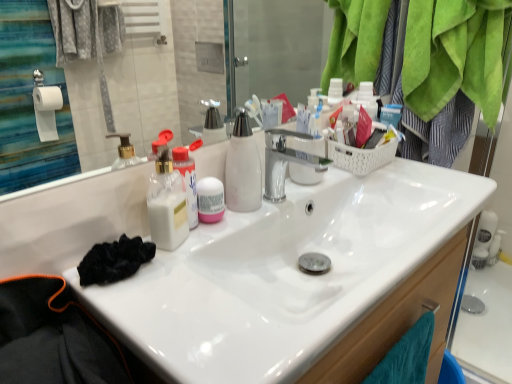
Measure the distance between point (386, 200) and camera.

They are 38.78 inches apart.

This screenshot has height=384, width=512. Describe the element at coordinates (334, 241) in the screenshot. I see `white glossy sink at center` at that location.

Locate an element on the screen. white glossy sink at center is located at coordinates (334, 241).

You are a GUI agent. You are given a task and a screenshot of the screen. Output one action in this format:
    pyautogui.click(x=<x>, y=<y>)
    Task: Click on the pink matte deodorant at center
    
    Given the screenshot: What is the action you would take?
    pyautogui.click(x=210, y=200)

This screenshot has height=384, width=512. Describe the element at coordinates (210, 200) in the screenshot. I see `pink matte deodorant at center` at that location.

You are a GUI agent. You are given a task and a screenshot of the screen. Output one action in this format:
    pyautogui.click(x=<x>, y=<y>)
    Task: Click on the white glossy sink at center
    This screenshot has height=384, width=512.
    Given the screenshot: What is the action you would take?
    pyautogui.click(x=334, y=241)

Which object is positioned more to the left, pink matte deodorant at center or white glossy sink at center?

From the viewer's perspective, pink matte deodorant at center appears more on the left side.

Which is behind, pink matte deodorant at center or white glossy sink at center?

pink matte deodorant at center is further from the camera.

Between point (209, 199) and point (354, 311), which one is positioned in front?

Positioned in front is point (354, 311).

From the image's perspective, is pink matte deodorant at center on top of white glossy sink at center?

Yes, from the image's perspective, pink matte deodorant at center is above white glossy sink at center.

From the picture: From a real-world perspective, is pink matte deodorant at center under white glossy sink at center?

No, from a real-world perspective, pink matte deodorant at center is not below white glossy sink at center.

Between pink matte deodorant at center and white glossy sink at center, which one has smaller width?

With smaller width is pink matte deodorant at center.

Can you confirm if pink matte deodorant at center is taller than white glossy sink at center?

No.

Who is smaller, pink matte deodorant at center or white glossy sink at center?

pink matte deodorant at center.

Is pink matte deodorant at center outside of white glossy sink at center?

Yes.

Are pink matte deodorant at center and white glossy sink at center located far from each other?

No, pink matte deodorant at center is in close proximity to white glossy sink at center.

Could you tell me if pink matte deodorant at center is facing white glossy sink at center?

No, pink matte deodorant at center is not oriented towards white glossy sink at center.

How many degrees apart are the facing directions of pink matte deodorant at center and white glossy sink at center?

4.68 degrees separate the facing orientations of pink matte deodorant at center and white glossy sink at center.

Measure the distance between pink matte deodorant at center and white glossy sink at center.

A distance of 27.45 centimeters exists between pink matte deodorant at center and white glossy sink at center.

The image size is (512, 384). I want to click on sink below the pink matte deodorant at center (from the image's perspective), so click(334, 241).

Considering the positions of objects white glossy sink at center and pink matte deodorant at center in the image provided, who is more to the left, white glossy sink at center or pink matte deodorant at center?

pink matte deodorant at center is more to the left.

Looking at this image, between white glossy sink at center and pink matte deodorant at center, which one is positioned behind?

pink matte deodorant at center is behind.

From the picture: Which is less distant, (263,203) or (201,192)?

Point (263,203) is positioned farther from the camera compared to point (201,192).

From the image's perspective, is white glossy sink at center located above or below pink matte deodorant at center?

Based on their image positions, white glossy sink at center is located beneath pink matte deodorant at center.

From a real-world perspective, is white glossy sink at center physically below pink matte deodorant at center?

Correct, in the physical world, white glossy sink at center is lower than pink matte deodorant at center.

Is white glossy sink at center wider or thinner than pink matte deodorant at center?

Clearly, white glossy sink at center has more width compared to pink matte deodorant at center.

Does white glossy sink at center have a lesser height compared to pink matte deodorant at center?

No.

In terms of size, does white glossy sink at center appear bigger or smaller than pink matte deodorant at center?

Considering their sizes, white glossy sink at center takes up more space than pink matte deodorant at center.

Would you say white glossy sink at center is outside pink matte deodorant at center?

Yes, white glossy sink at center is not within pink matte deodorant at center.

Is white glossy sink at center far from pink matte deodorant at center?

white glossy sink at center is near pink matte deodorant at center, not far away.

Is white glossy sink at center facing towards pink matte deodorant at center?

No, white glossy sink at center does not turn towards pink matte deodorant at center.

The image size is (512, 384). I want to click on sink in front of the pink matte deodorant at center, so click(334, 241).

Identify the location of sink in front of the pink matte deodorant at center. Image resolution: width=512 pixels, height=384 pixels. (334, 241).

This screenshot has width=512, height=384. I want to click on toiletries on the left of the white glossy sink at center, so click(x=210, y=200).